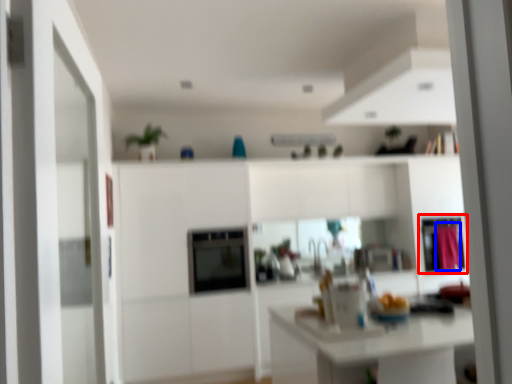
Question: Which object appears farthest to the camera in this image, cabinetry (highlighted by a red box) or curtain (highlighted by a blue box)?

Choices:
 (A) cabinetry
 (B) curtain

Answer: (A)